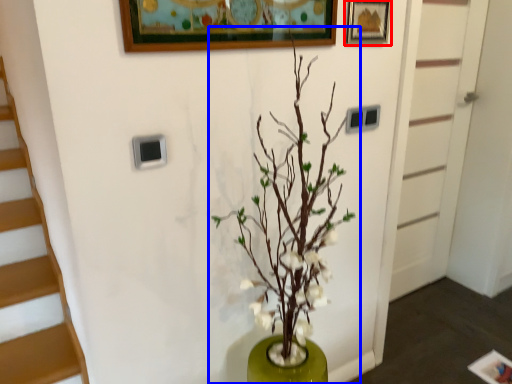
Question: Which of the following is the closest to the observer, picture frame (highlighted by a red box) or houseplant (highlighted by a blue box)?

Choices:
 (A) picture frame
 (B) houseplant

Answer: (B)